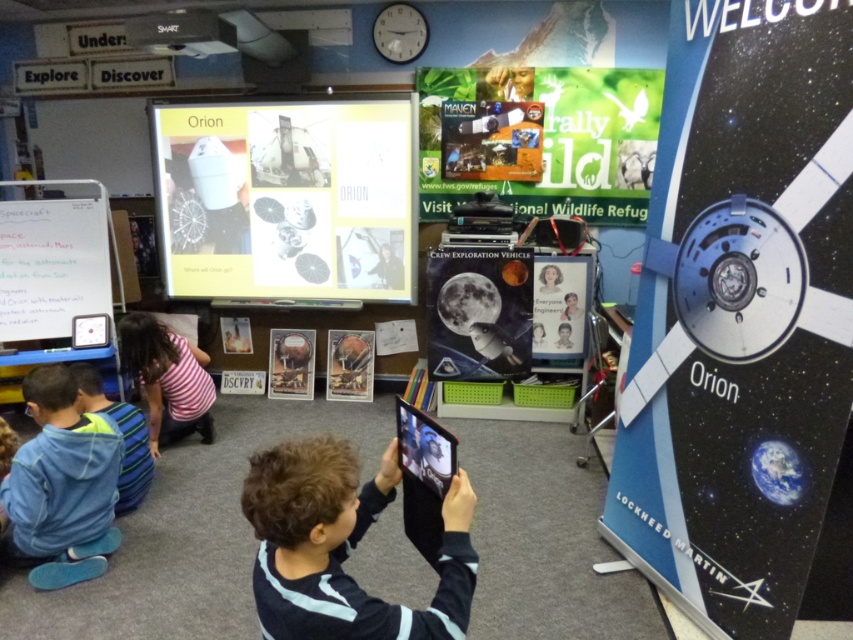
What do you see at coordinates (741, 314) in the screenshot? The width and height of the screenshot is (853, 640). I see `metallic blue and white orion spacecraft at right` at bounding box center [741, 314].

Who is positioned more to the left, metallic blue and white orion spacecraft at right or white paper at upper center?

From the viewer's perspective, white paper at upper center appears more on the left side.

Is point (807, 385) farther from viewer compared to point (253, 260)?

No, it is in front of (253, 260).

This screenshot has height=640, width=853. Identify the location of metallic blue and white orion spacecraft at right. (741, 314).

Is point (396, 477) positioned behind point (128, 454)?

No, (396, 477) is in front of (128, 454).

Identify the location of black matte tablet at center. The width and height of the screenshot is (853, 640). (341, 547).

Is point (125, 317) closer to viewer compared to point (567, 262)?

That is True.

Describe the element at coordinates (167, 380) in the screenshot. I see `striped fabric at lower left` at that location.

Which is in front, point (173, 404) or point (543, 339)?

Positioned in front is point (173, 404).

Locate an element on the screen. The height and width of the screenshot is (640, 853). striped fabric at lower left is located at coordinates (167, 380).